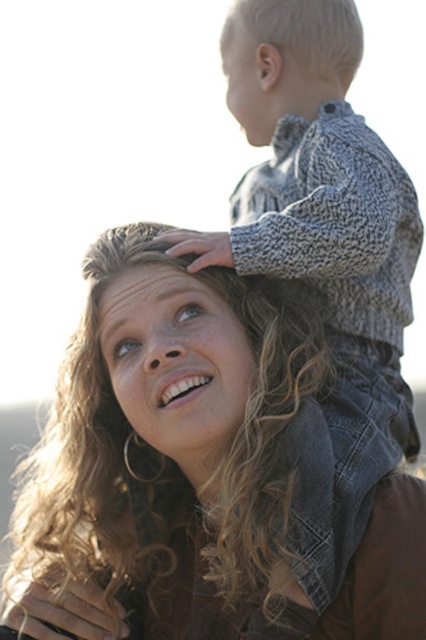
You are standing 6 meters away from a woman with blonde hair at center. Can you clearly see her facial expression?

The blonde hair at center and viewer are 6.32 meters apart, so you are standing 6 meters away from the woman with blonde hair at center. Since the distance is slightly closer than 6.32 meters, you can clearly see her facial expression.

You are a photographer trying to capture a candid shot of the curly blonde hair at upper center and the blonde hair at center. The camera you are using has a minimum focus distance of 1.2 meters. Can you focus on both subjects simultaneously?

The distance between curly blonde hair at upper center and blonde hair at center is 1.32 meters, which is greater than the camera minimum focus distance of 1.2 meters. Therefore, the camera can focus on both subjects simultaneously.